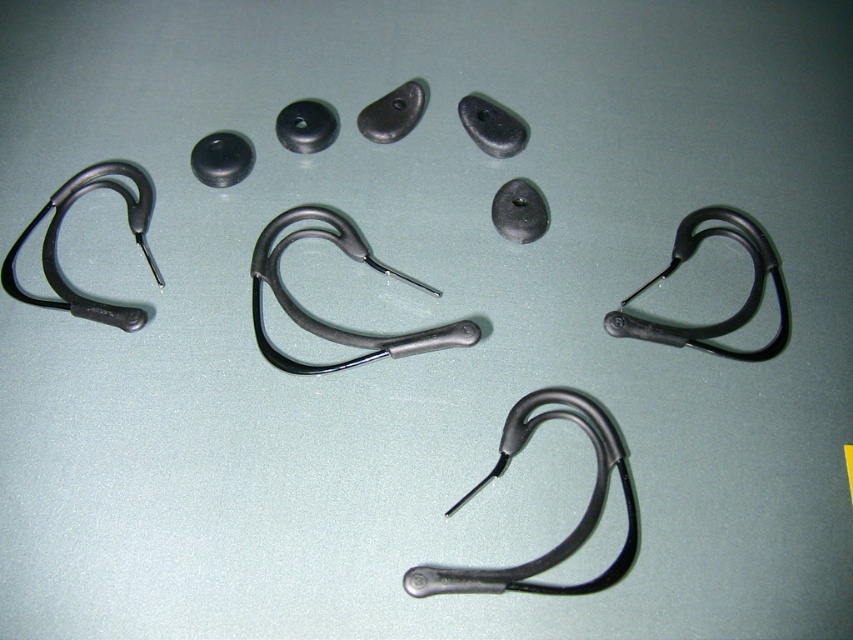
You are a customer trying to choose between the matte black earhook at center and the black rubber earhook at upper right for your earbuds. Based on their sizes, which one would you recommend for someone who prefers a larger earhook?

The matte black earhook at center is much taller than the black rubber earhook at upper right, so it would be the better choice for someone preferring a larger earhook.

You are a medical professional preparing to sterilize equipment. You have a matte black stethoscope at center and a matte black earhook at left on your tray. Which item requires a wider sterilization container to fit properly?

The matte black stethoscope at center requires a wider sterilization container because its width surpasses that of the matte black earhook at left.